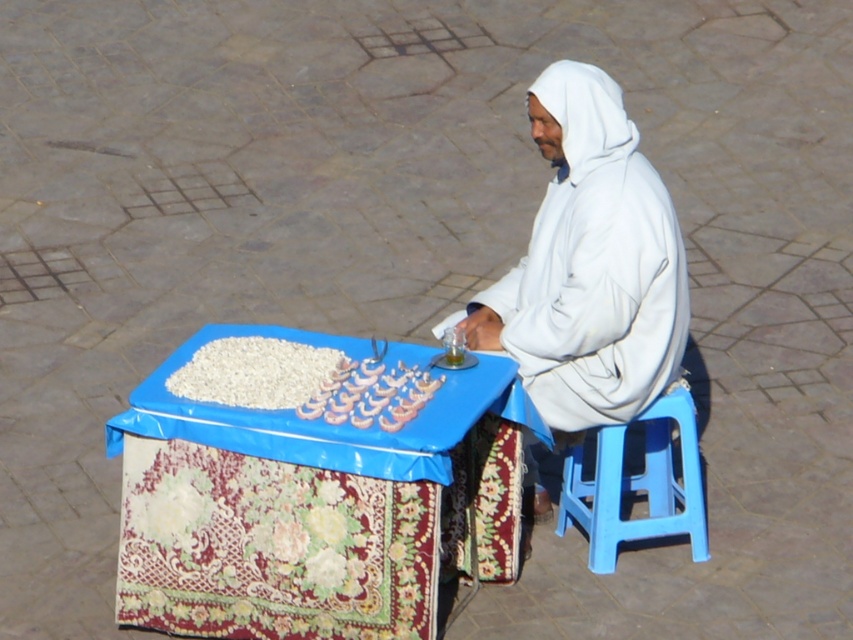
You are a customer looking to sit down to eat the white matte grains at center. Is the blue plastic stool at lower right tall enough for you to comfortably sit at the table?

The blue plastic stool at lower right has a greater height compared to white matte grains at center, so yes, the stool is tall enough for you to comfortably sit at the table.

You are a customer at a market stall and want to buy both the white matte hoodie at center and the white matte grains at center. The vendor tells you that the hoodie is taller than the grains. Which item should you point to if you want the taller one?

The white matte hoodie at center is taller than the white matte grains at center, so you should point to the white matte hoodie at center.

You are a customer at this outdoor market and want to buy some of the white matte grains at center. The vendor is sitting on the blue plastic stool at lower right. To approach the grains, should you walk to the left or right of the vendor?

You should walk to the left of the vendor because the blue plastic stool at lower right is to the right of the white matte grains at center, meaning the grains are on the vendor left side.